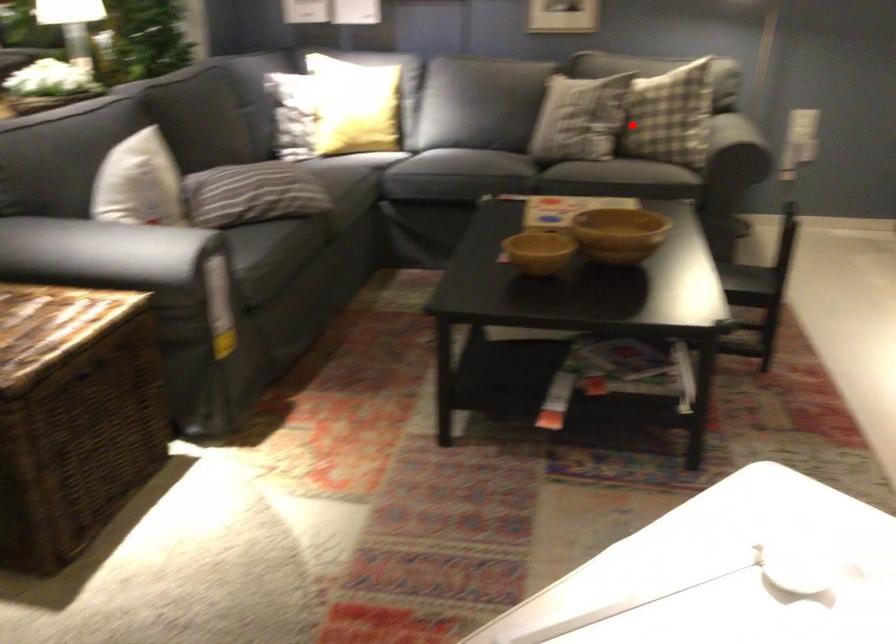
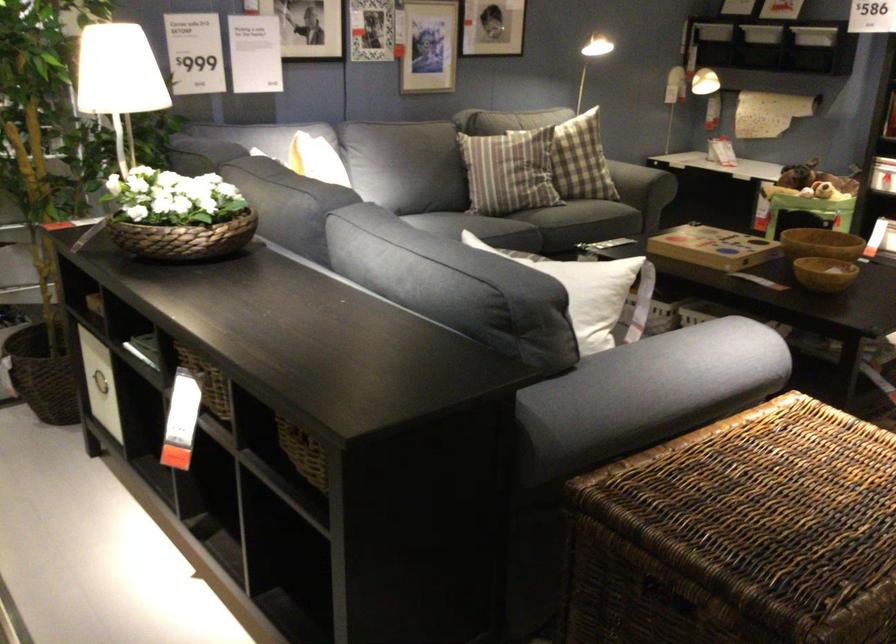
The point at the highlighted location is marked in the first image. Where is the corresponding point in the second image?

(633, 180)